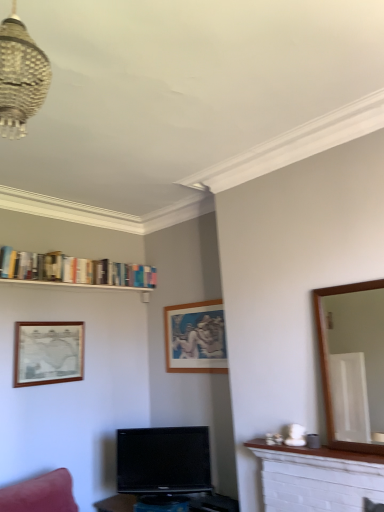
Question: Considering the relative sizes of wooden picture frame at left, arranged as the 2th picture frame when viewed from the right, and black glossy tv at center in the image provided, is wooden picture frame at left, arranged as the 2th picture frame when viewed from the right, thinner than black glossy tv at center?

Choices:
 (A) no
 (B) yes

Answer: (B)

Question: Does wooden picture frame at left, which is the 1th picture frame in left-to-right order, turn towards black glossy tv at center?

Choices:
 (A) yes
 (B) no

Answer: (B)

Question: Considering the relative sizes of wooden picture frame at left, which is the 1th picture frame in left-to-right order, and black glossy tv at center in the image provided, is wooden picture frame at left, which is the 1th picture frame in left-to-right order, wider than black glossy tv at center?

Choices:
 (A) no
 (B) yes

Answer: (A)

Question: Would you say black glossy tv at center is part of wooden picture frame at left, arranged as the 2th picture frame when viewed from the right,'s contents?

Choices:
 (A) no
 (B) yes

Answer: (A)

Question: From the image's perspective, would you say wooden picture frame at left, arranged as the 2th picture frame when viewed from the right, is shown under black glossy tv at center?

Choices:
 (A) no
 (B) yes

Answer: (A)

Question: From the image's perspective, would you say wooden picture frame at left, arranged as the 2th picture frame when viewed from the right, is positioned over black glossy tv at center?

Choices:
 (A) yes
 (B) no

Answer: (A)

Question: Is the position of wooden picture frame at center, the 2th picture frame from the left, more distant than that of black glossy tv at center?

Choices:
 (A) no
 (B) yes

Answer: (B)

Question: Can you confirm if wooden picture frame at center, the 2th picture frame from the left, is wider than black glossy tv at center?

Choices:
 (A) yes
 (B) no

Answer: (B)

Question: Is wooden picture frame at center, the 2th picture frame from the left, outside of black glossy tv at center?

Choices:
 (A) no
 (B) yes

Answer: (B)

Question: Is wooden picture frame at center, the 2th picture frame from the left, shorter than black glossy tv at center?

Choices:
 (A) no
 (B) yes

Answer: (A)

Question: Can you confirm if wooden picture frame at center, the 2th picture frame from the left, is smaller than black glossy tv at center?

Choices:
 (A) no
 (B) yes

Answer: (B)

Question: Is wooden picture frame at center, the 2th picture frame from the left, looking in the opposite direction of black glossy tv at center?

Choices:
 (A) yes
 (B) no

Answer: (B)

Question: Does black glossy tv at center come behind white brick fireplace at lower right?

Choices:
 (A) yes
 (B) no

Answer: (A)